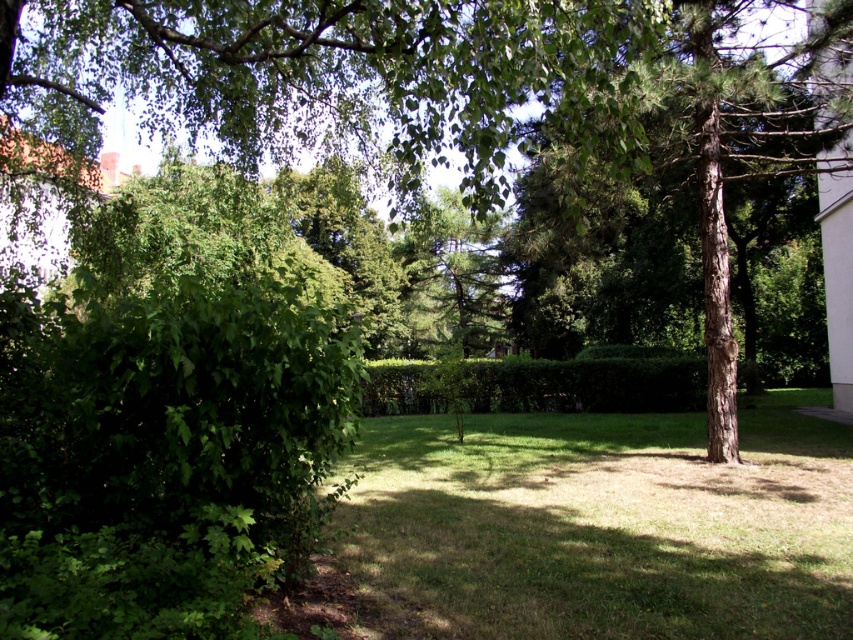
Measure the distance between point [833,161] and camera.

Point [833,161] is 41.93 feet from camera.

Identify the location of brown rough bark tree at center. (701, 205).